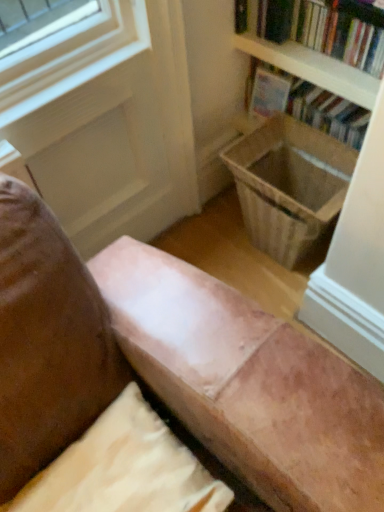
Question: From a real-world perspective, is hardcover book at upper right, which appears as the 1th book when viewed from the front, below suede-like beige pillow at lower center?

Choices:
 (A) no
 (B) yes

Answer: (A)

Question: Considering the relative sizes of hardcover book at upper right, which appears as the 1th book when viewed from the front, and suede-like beige pillow at lower center in the image provided, is hardcover book at upper right, which appears as the 1th book when viewed from the front, shorter than suede-like beige pillow at lower center?

Choices:
 (A) yes
 (B) no

Answer: (B)

Question: Would you say suede-like beige pillow at lower center is part of hardcover book at upper right, which appears as the 1th book when viewed from the front,'s contents?

Choices:
 (A) yes
 (B) no

Answer: (B)

Question: Is hardcover book at upper right, which appears as the 1th book when viewed from the front, far away from suede-like beige pillow at lower center?

Choices:
 (A) no
 (B) yes

Answer: (B)

Question: Does hardcover book at upper right, which appears as the 2th book when viewed from the back, have a smaller size compared to suede-like beige pillow at lower center?

Choices:
 (A) no
 (B) yes

Answer: (A)

Question: Is hardcover book at upper right, which appears as the 2th book when viewed from the back, bigger than suede-like beige pillow at lower center?

Choices:
 (A) no
 (B) yes

Answer: (B)

Question: Is hardcover book at upper right, the 1th book in the back-to-front sequence, surrounded by suede-like beige pillow at lower center?

Choices:
 (A) no
 (B) yes

Answer: (A)

Question: Is suede-like beige pillow at lower center wider than hardcover book at upper right, the 2th book from the front?

Choices:
 (A) no
 (B) yes

Answer: (B)

Question: Can we say suede-like beige pillow at lower center lies outside hardcover book at upper right, the 1th book in the back-to-front sequence?

Choices:
 (A) yes
 (B) no

Answer: (A)

Question: Is suede-like beige pillow at lower center shorter than hardcover book at upper right, the 2th book from the front?

Choices:
 (A) yes
 (B) no

Answer: (A)

Question: From a real-world perspective, is suede-like beige pillow at lower center located higher than hardcover book at upper right, the 2th book from the front?

Choices:
 (A) yes
 (B) no

Answer: (A)

Question: Is suede-like beige pillow at lower center looking in the opposite direction of hardcover book at upper right, the 1th book in the back-to-front sequence?

Choices:
 (A) no
 (B) yes

Answer: (A)

Question: Does hardcover book at upper right, the 2th book from the front, have a larger size compared to wooden laundry basket at lower right?

Choices:
 (A) yes
 (B) no

Answer: (A)